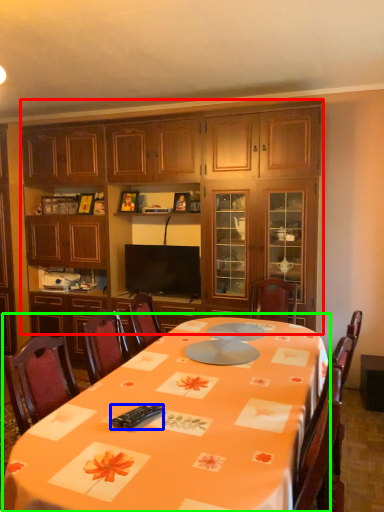
Question: Which object is the closest to the cabinetry (highlighted by a red box)? Choose among these: remote control (highlighted by a blue box) or round table (highlighted by a green box).

Choices:
 (A) remote control
 (B) round table

Answer: (B)